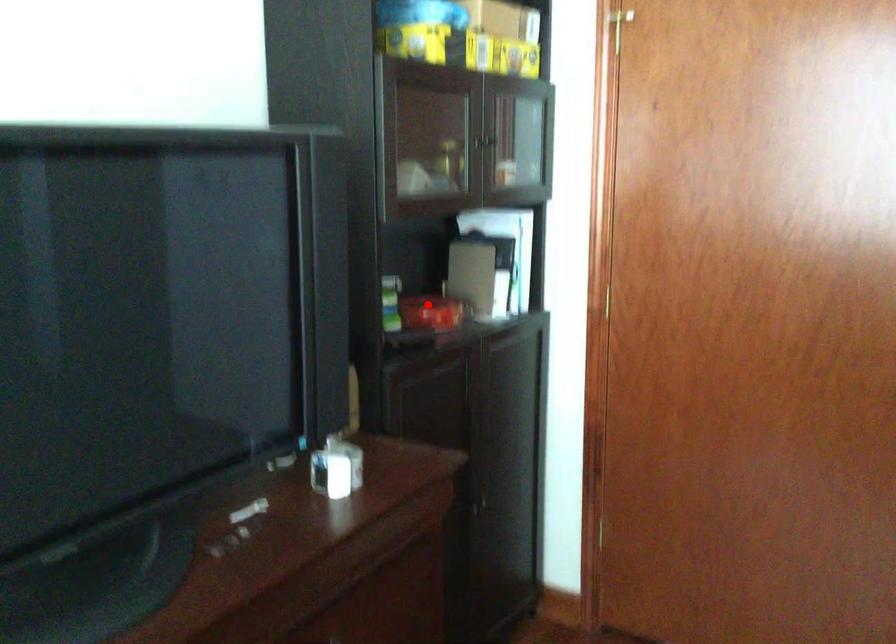
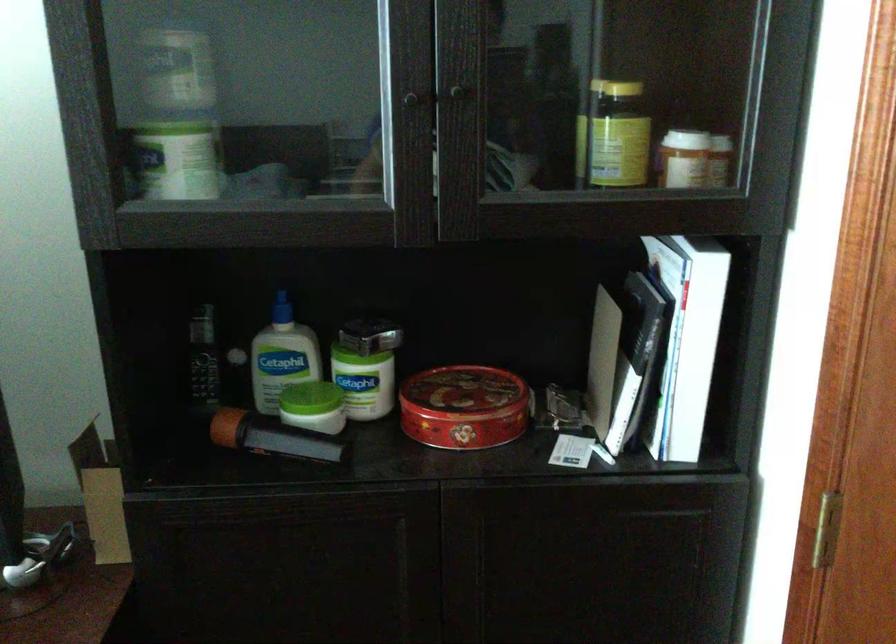
Question: I am providing you with two images of the same scene from different viewpoints. A red point is marked on the first image. At the location where the point appears in image 1, is it still visible in image 2?

Choices:
 (A) Yes
 (B) No

Answer: (A)